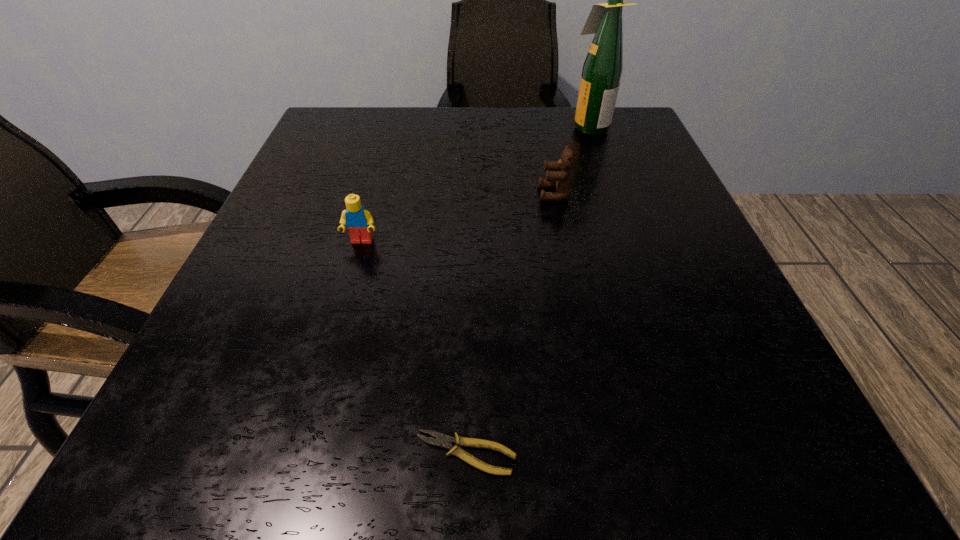
I want to click on blank area in the image that satisfies the following two spatial constraints: 1. on the front-facing side of the farthest object; 2. on the front-facing side of the leftmost object, so [630, 241].

The image size is (960, 540). Identify the location of free location that satisfies the following two spatial constraints: 1. on the front-facing side of the liquor; 2. on the front-facing side of the leftmost object. (630, 241).

The width and height of the screenshot is (960, 540). What are the coordinates of `free space in the image that satisfies the following two spatial constraints: 1. on the front-facing side of the farthest object; 2. on the front side of the nearest object` in the screenshot? It's located at (705, 454).

This screenshot has width=960, height=540. What are the coordinates of `free space that satisfies the following two spatial constraints: 1. on the face of the teddy bear; 2. on the front-facing side of the Lego` in the screenshot? It's located at (564, 241).